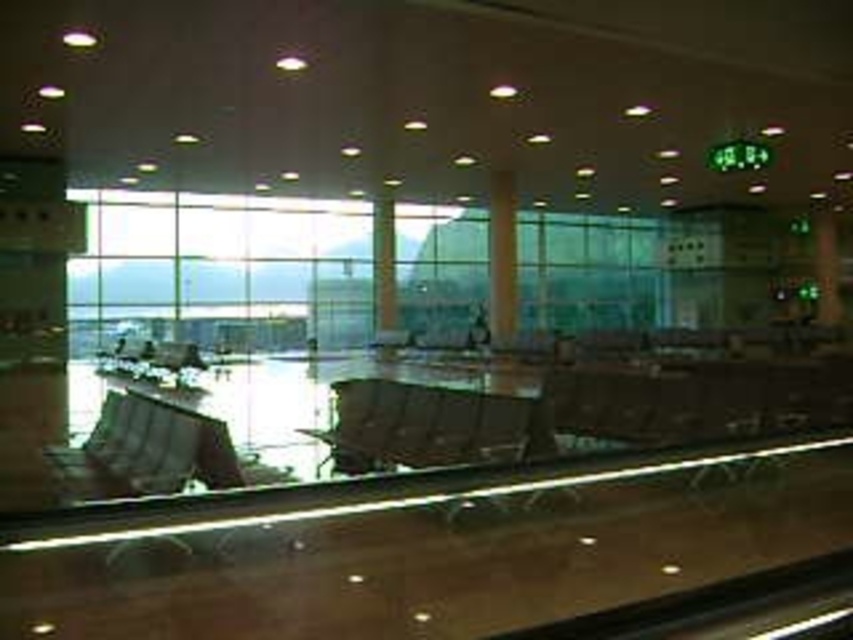
Who is positioned more to the left, brown wood pillar at center or green glass pillar at center?

From the viewer's perspective, green glass pillar at center appears more on the left side.

From the picture: How far apart are brown wood pillar at center and green glass pillar at center?

brown wood pillar at center is 5.76 meters away from green glass pillar at center.

I want to click on brown wood pillar at center, so click(x=502, y=257).